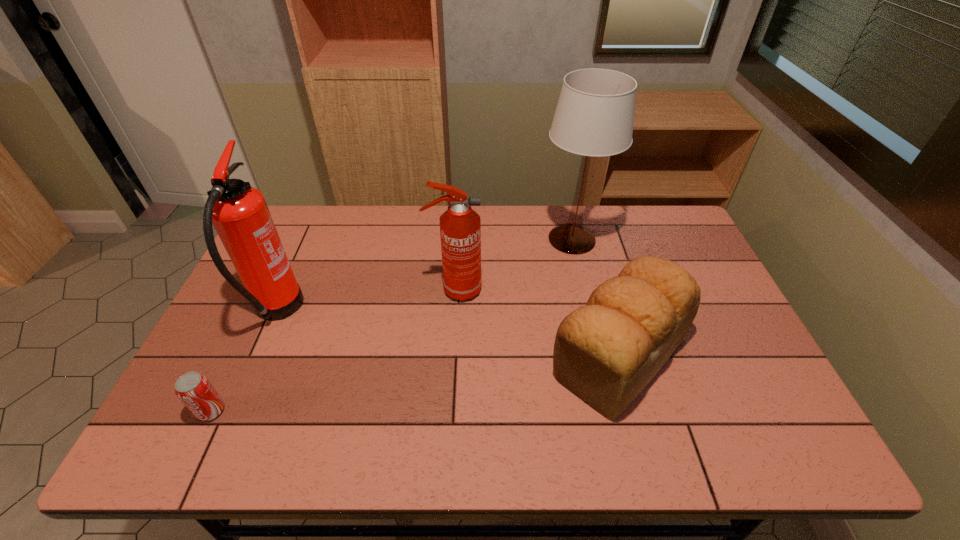
The width and height of the screenshot is (960, 540). Identify the location of vacant space that satisfies the following two spatial constraints: 1. above the cylindrical shade of the table lamp; 2. on the right side of the bread. (599, 355).

Identify the location of free point that satisfies the following two spatial constraints: 1. at the nozzle of the shorter fire extinguisher; 2. on the logo side of the soda can. Image resolution: width=960 pixels, height=540 pixels. (447, 411).

Find the location of a particular element. This screenshot has width=960, height=540. vacant space that satisfies the following two spatial constraints: 1. above the cylindrical shade of the table lamp; 2. on the right side of the second shortest object is located at coordinates (599, 355).

At what (x,y) coordinates should I click in order to perform the action: click on vacant space that satisfies the following two spatial constraints: 1. above the cylindrical shade of the table lamp; 2. on the right side of the bread. Please return your answer as a coordinate pair (x, y). Looking at the image, I should click on (599, 355).

You are a GUI agent. You are given a task and a screenshot of the screen. Output one action in this format:
    pyautogui.click(x=<x>, y=<y>)
    Task: Click on the vacant region that satisfies the following two spatial constraints: 1. on the back side of the bread; 2. above the cylindrical shade of the farthest object
    
    Given the screenshot: What is the action you would take?
    click(x=588, y=239)

Where is `free region that satisfies the following two spatial constraints: 1. on the back side of the fourth tallest object; 2. at the nozzle of the left fire extinguisher`? Image resolution: width=960 pixels, height=540 pixels. free region that satisfies the following two spatial constraints: 1. on the back side of the fourth tallest object; 2. at the nozzle of the left fire extinguisher is located at coordinates (608, 312).